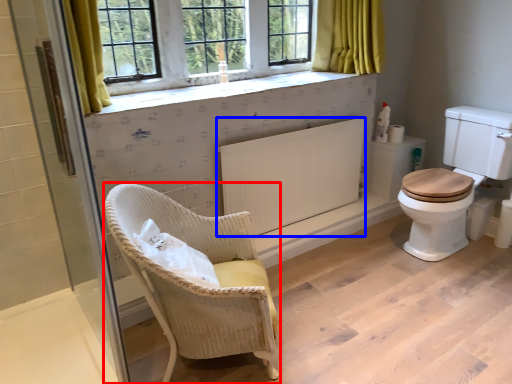
Question: Which of the following is the farthest to the observer, chair (highlighted by a red box) or radiator (highlighted by a blue box)?

Choices:
 (A) chair
 (B) radiator

Answer: (B)